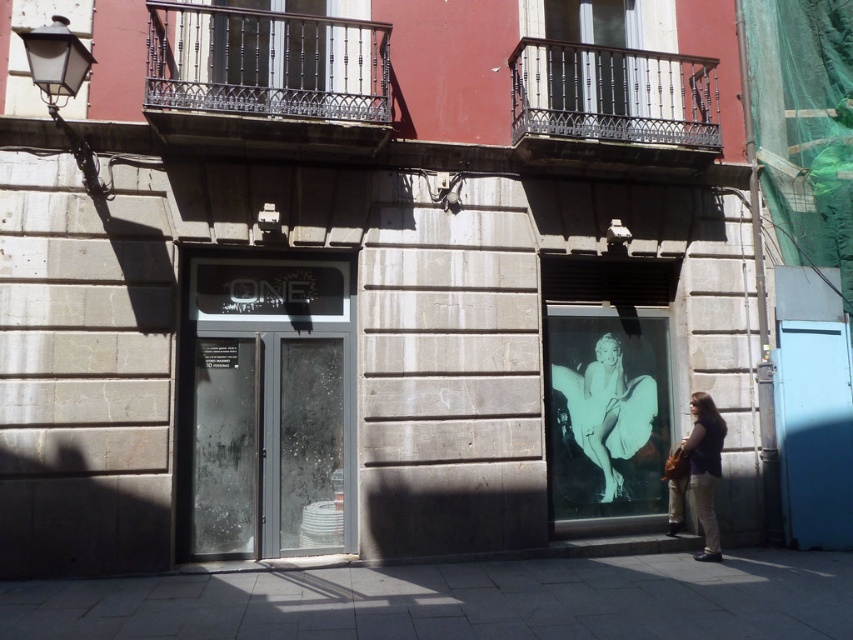
Does gray concrete pavement at lower center appear over matte brown jacket at lower right?

No.

In the scene shown: Does gray concrete pavement at lower center come behind matte brown jacket at lower right?

No, it is in front of matte brown jacket at lower right.

Does point (141, 621) come closer to viewer compared to point (703, 474)?

That is True.

Image resolution: width=853 pixels, height=640 pixels. In order to click on gray concrete pavement at lower center in this screenshot , I will do `click(457, 602)`.

Between transparent glass door at center and matte brown jacket at lower right, which one has more height?

transparent glass door at center

Is transparent glass door at center positioned at the back of matte brown jacket at lower right?

No, it is in front of matte brown jacket at lower right.

The image size is (853, 640). What do you see at coordinates (270, 444) in the screenshot?
I see `transparent glass door at center` at bounding box center [270, 444].

Locate an element on the screen. The image size is (853, 640). transparent glass door at center is located at coordinates (270, 444).

Does gray concrete pavement at lower center appear on the right side of silvery metallic poster at center?

Yes, gray concrete pavement at lower center is to the right of silvery metallic poster at center.

Between gray concrete pavement at lower center and silvery metallic poster at center, which one has less height?

gray concrete pavement at lower center

Image resolution: width=853 pixels, height=640 pixels. I want to click on gray concrete pavement at lower center, so click(x=457, y=602).

At what (x,y) coordinates should I click in order to perform the action: click on gray concrete pavement at lower center. Please return your answer as a coordinate pair (x, y). This screenshot has width=853, height=640. Looking at the image, I should click on (457, 602).